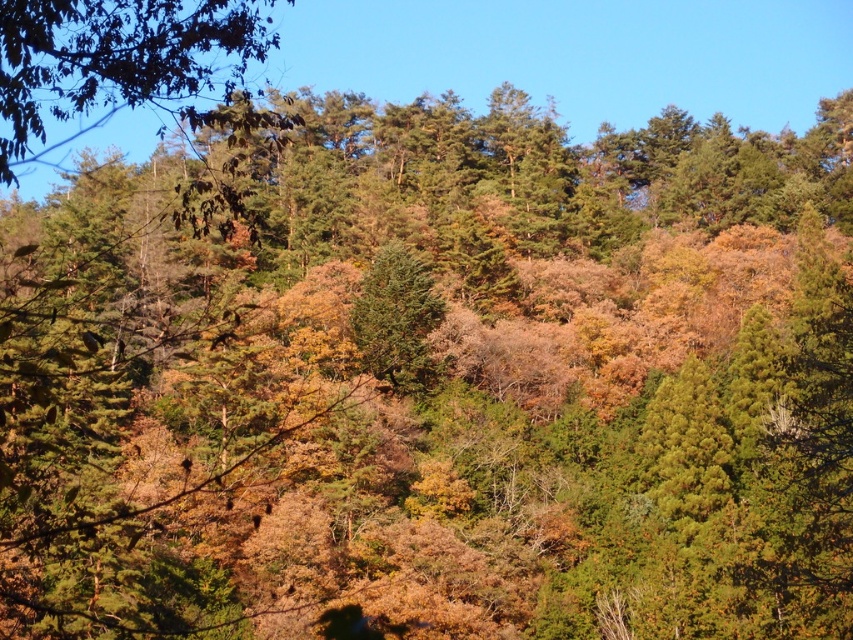
You are a hiker navigating through the forest and want to reach the green matte tree at center. Which direction should you move relative to the green matte tree at upper left to get there?

You should move away from the green matte tree at upper left because the green matte tree at center is further away from the viewer than the green matte tree at upper left.

You are a hiker trying to navigate through the forest. You see a green matte tree at upper left and a green matte tree at center. Which tree is closer to you?

The green matte tree at upper left is closer to you since it is only 27.37 meters away from the green matte tree at center, which is farther away.

You are an explorer navigating through the forest and want to reach the green matte tree at center. Which direction should you move relative to the green matte tree at upper left to get there?

To reach the green matte tree at center from the green matte tree at upper left, you should move to the right since the green matte tree at upper left is located to the left of the green matte tree at center.